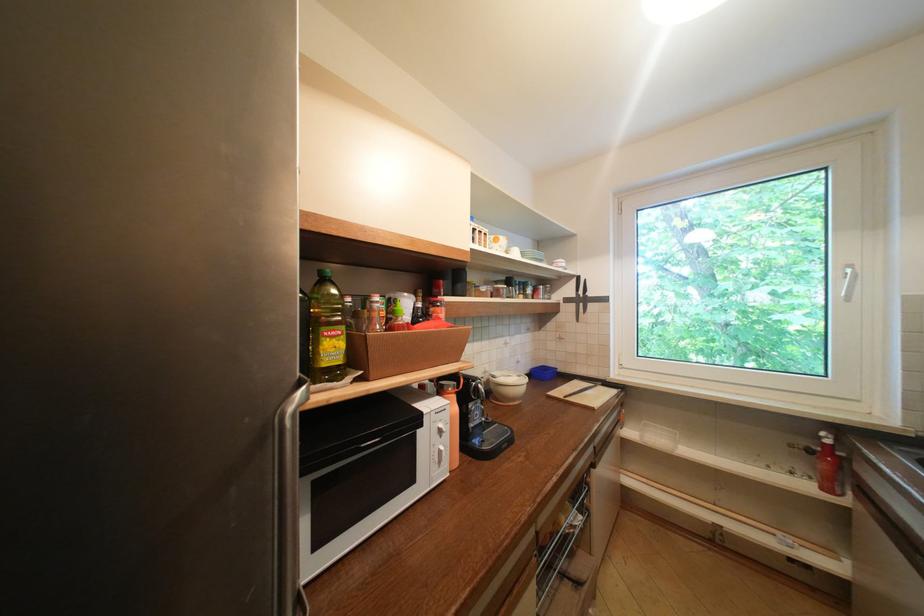
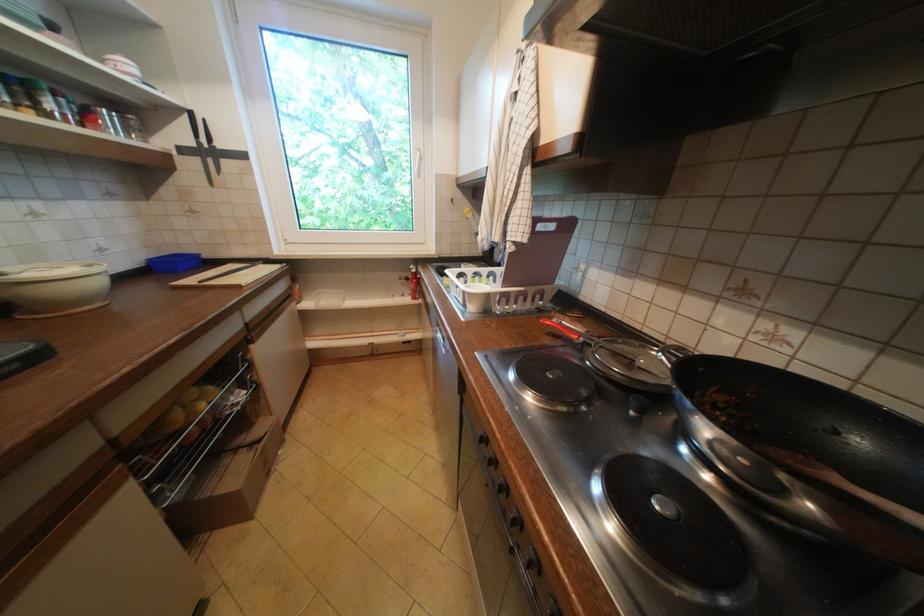
In the second image, find the point that corresponds to (609,384) in the first image.

(270, 262)